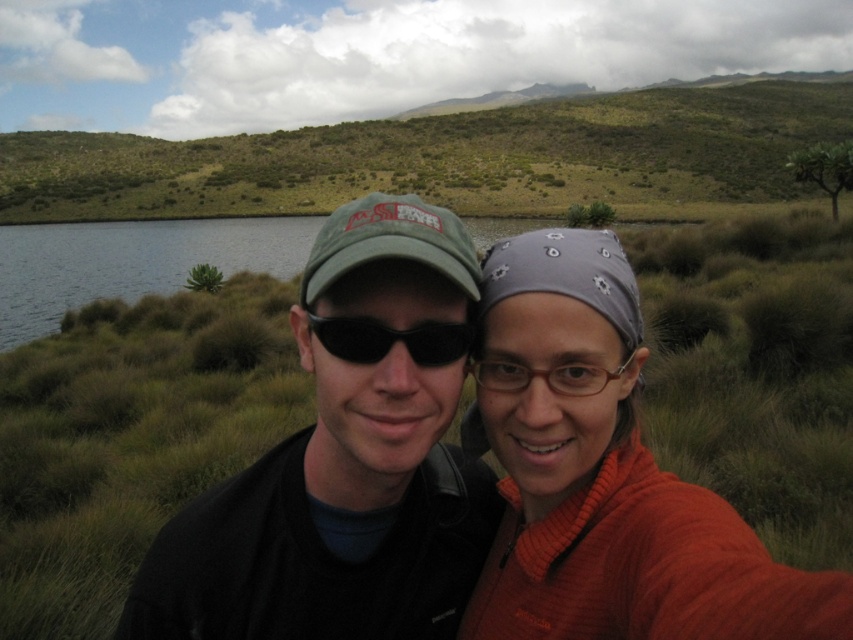
You are a photographer trying to capture a clear shot of both the matte green cap at center and the orange knitted sweater at center in the image. Since you want to focus on their heights, which object should you adjust your camera angle to prioritize?

The matte green cap at center is much taller than the orange knitted sweater at center, so you should adjust your camera angle to prioritize the matte green cap at center to ensure it is fully in frame and properly focused.

You are a photographer trying to capture the matte green cap at center in the image. The camera you are using has a focal point at point (346, 460). Will this focal point successfully capture the matte green cap at center?

Yes, the focal point at point (346, 460) corresponds to the matte green cap at center, so the camera will successfully capture it.

You are a photographer trying to capture a clear shot of both the matte green cap at center and the orange knitted sweater at center. Since you want to focus on the smaller object, which one should you prioritize framing in your shot?

The matte green cap at center has a smaller size compared to orange knitted sweater at center, so you should prioritize framing the matte green cap at center to ensure it is clearly visible in the shot.